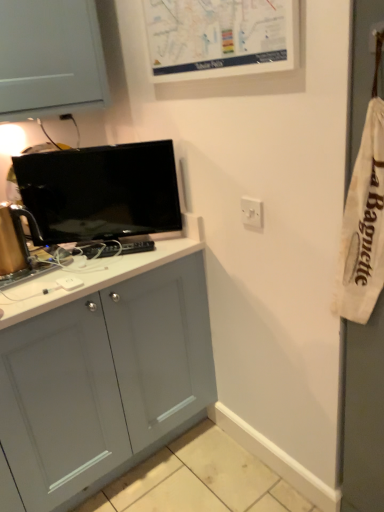
Locate an element on the screen. This screenshot has height=512, width=384. free space above matte black tv at upper left (from a real-world perspective) is located at coordinates (84, 151).